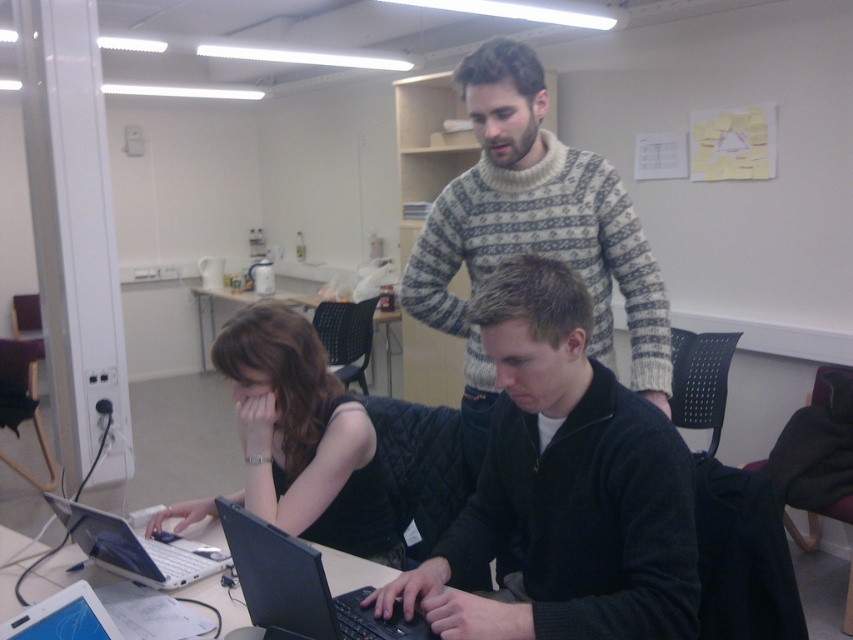
Can you confirm if black matte laptop at center is positioned to the right of black plastic table at center?

Indeed, black matte laptop at center is positioned on the right side of black plastic table at center.

Between black matte laptop at center and black plastic table at center, which one has more height?

Standing taller between the two is black matte laptop at center.

Identify the location of black matte laptop at center. Image resolution: width=853 pixels, height=640 pixels. (300, 588).

Can you confirm if black matte shirt at center is positioned above matte black tablet at lower left?

Correct, black matte shirt at center is located above matte black tablet at lower left.

Is black matte shirt at center taller than matte black tablet at lower left?

Correct, black matte shirt at center is much taller as matte black tablet at lower left.

What are the coordinates of `black matte shirt at center` in the screenshot? It's located at coord(303,436).

Between black matte sweater at center and matte black tablet at lower left, which one appears on the left side from the viewer's perspective?

matte black tablet at lower left

Is black matte sweater at center positioned before matte black tablet at lower left?

That is False.

Which is in front, point (550, 442) or point (86, 621)?

Point (86, 621) is more forward.

Find the location of a particular element. This screenshot has height=640, width=853. black matte sweater at center is located at coordinates (563, 486).